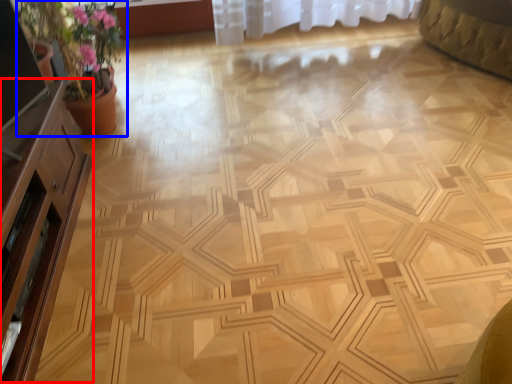
Question: Which object appears farthest to the camera in this image, dresser (highlighted by a red box) or houseplant (highlighted by a blue box)?

Choices:
 (A) dresser
 (B) houseplant

Answer: (B)